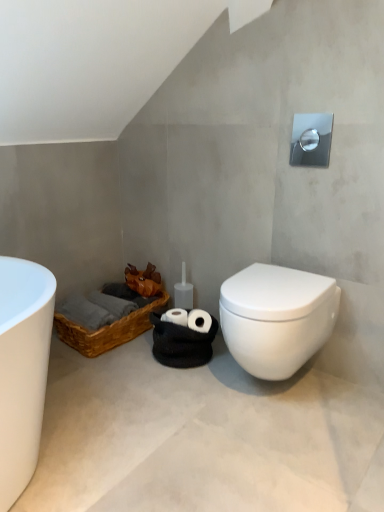
You are a GUI agent. You are given a task and a screenshot of the screen. Output one action in this format:
    pyautogui.click(x=<x>, y=<y>)
    Task: Click on the blank area beneath white glossy toilet at lower right (from a real-world perspective)
    
    Given the screenshot: What is the action you would take?
    pyautogui.click(x=274, y=393)